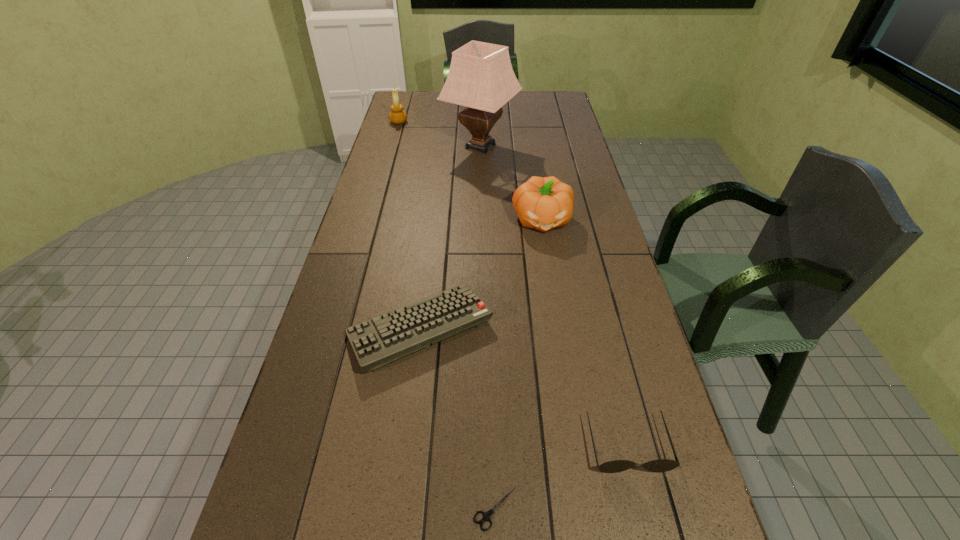
You are a GUI agent. You are given a task and a screenshot of the screen. Output one action in this format:
    pyautogui.click(x=<x>, y=<y>)
    Task: Click on the vacant region located on the back of the lampshade
    The width and height of the screenshot is (960, 540).
    Given the screenshot: What is the action you would take?
    pyautogui.click(x=480, y=101)

Image resolution: width=960 pixels, height=540 pixels. I want to click on free spot located on the right of the candle_holder, so click(430, 122).

I want to click on free space located on the carved face of the fourth nearest object, so click(x=561, y=333).

Image resolution: width=960 pixels, height=540 pixels. What are the coordinates of `free space located 0.250m on the front of the third nearest object` in the screenshot? It's located at (401, 487).

Find the location of a particular element. The image size is (960, 540). blank area located 0.270m on the back of the shears is located at coordinates (492, 372).

At what (x,y) coordinates should I click in order to perform the action: click on candle_holder present at the left edge. Please return your answer as a coordinate pair (x, y). This screenshot has height=540, width=960. Looking at the image, I should click on (397, 116).

Find the location of a particular element. The width and height of the screenshot is (960, 540). computer keyboard present at the left edge is located at coordinates (380, 340).

Identify the location of pumpkin present at the right edge. (544, 203).

Identify the location of sunglasses that is at the right edge. (662, 465).

The height and width of the screenshot is (540, 960). In the image, there is a desktop. What are the coordinates of `free space at the far edge` in the screenshot? It's located at (445, 109).